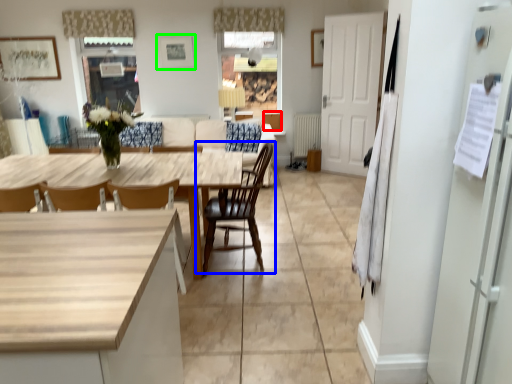
Question: Based on their relative distances, which object is farther from cabinetry (highlighted by a red box)? Choose from chair (highlighted by a blue box) and picture frame (highlighted by a green box).

Choices:
 (A) chair
 (B) picture frame

Answer: (A)